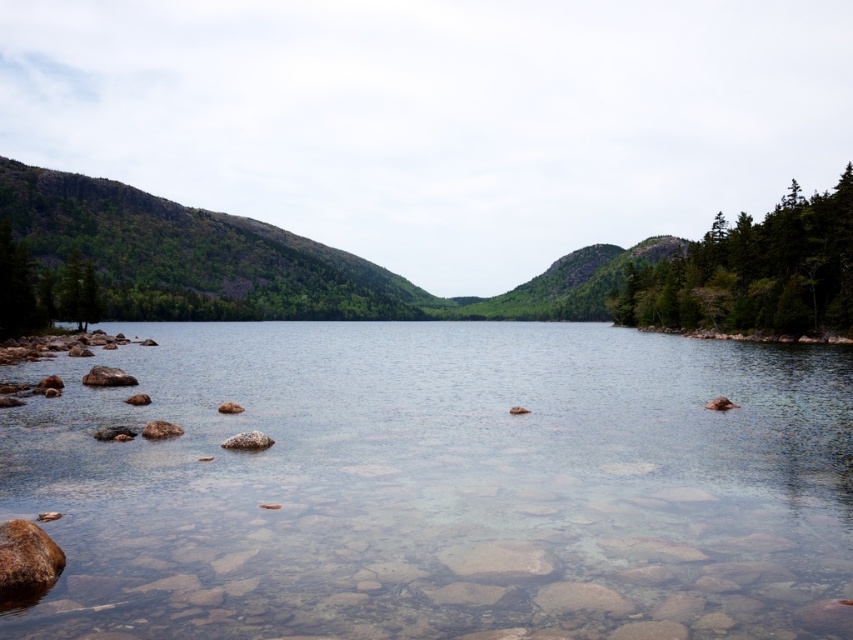
You are standing at the edge of the lake and notice the green rocky mountain at left and the green matte tree at left. Which one is positioned higher in the scene?

The green rocky mountain at left is positioned higher than the green matte tree at left in the scene.